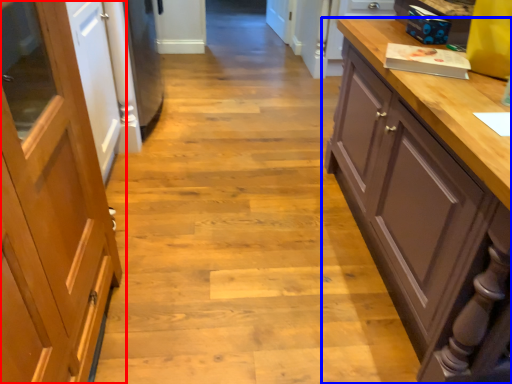
Question: Which of the following is the farthest to the observer, cabinetry (highlighted by a red box) or cupboard (highlighted by a blue box)?

Choices:
 (A) cabinetry
 (B) cupboard

Answer: (B)